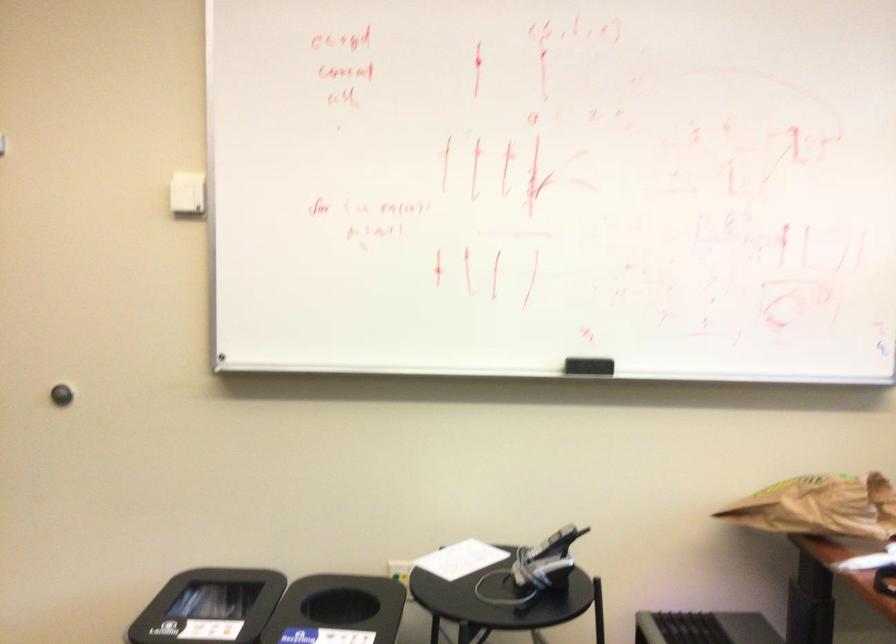
What do you see at coordinates (186, 194) in the screenshot? The height and width of the screenshot is (644, 896). I see `the white light switch` at bounding box center [186, 194].